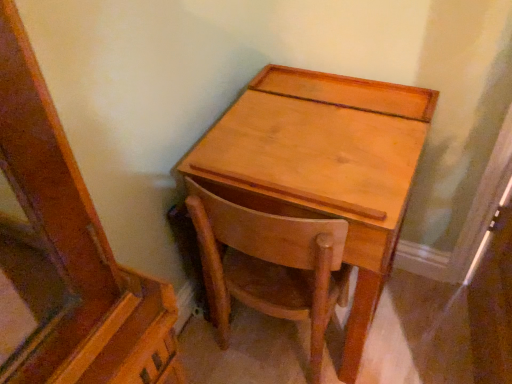
Question: From a real-world perspective, is light brown wood chair at center physically above light brown wood desk at center?

Choices:
 (A) yes
 (B) no

Answer: (B)

Question: From a real-world perspective, is light brown wood chair at center located beneath light brown wood desk at center?

Choices:
 (A) no
 (B) yes

Answer: (B)

Question: Is the depth of light brown wood chair at center greater than that of light brown wood desk at center?

Choices:
 (A) yes
 (B) no

Answer: (A)

Question: Considering the relative sizes of light brown wood chair at center and light brown wood desk at center in the image provided, is light brown wood chair at center taller than light brown wood desk at center?

Choices:
 (A) no
 (B) yes

Answer: (A)

Question: Does light brown wood chair at center come in front of light brown wood desk at center?

Choices:
 (A) yes
 (B) no

Answer: (B)

Question: Is light brown wood chair at center touching light brown wood desk at center?

Choices:
 (A) yes
 (B) no

Answer: (B)

Question: From a real-world perspective, is light brown wood desk at center physically below light brown wood chair at center?

Choices:
 (A) yes
 (B) no

Answer: (B)

Question: Would you say light brown wood desk at center contains light brown wood chair at center?

Choices:
 (A) yes
 (B) no

Answer: (A)

Question: Considering the relative sizes of light brown wood desk at center and light brown wood chair at center in the image provided, is light brown wood desk at center shorter than light brown wood chair at center?

Choices:
 (A) yes
 (B) no

Answer: (B)

Question: Is light brown wood desk at center smaller than light brown wood chair at center?

Choices:
 (A) no
 (B) yes

Answer: (A)

Question: Can you confirm if light brown wood desk at center is positioned to the right of light brown wood chair at center?

Choices:
 (A) no
 (B) yes

Answer: (B)

Question: Is light brown wood desk at center oriented away from light brown wood chair at center?

Choices:
 (A) yes
 (B) no

Answer: (A)

Question: Is light brown wood chair at center situated inside light brown wood desk at center or outside?

Choices:
 (A) outside
 (B) inside

Answer: (B)